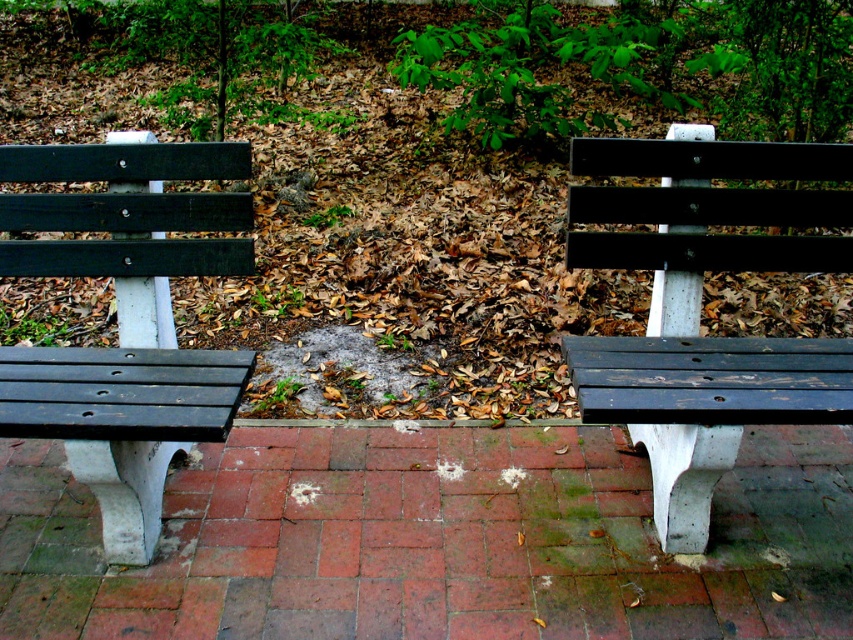
Who is positioned more to the right, matte black bench at right or matte black bench at left?

matte black bench at right

Identify the location of matte black bench at right. (704, 216).

Describe the element at coordinates (704, 216) in the screenshot. I see `matte black bench at right` at that location.

Find the location of a particular element. matte black bench at right is located at coordinates (704, 216).